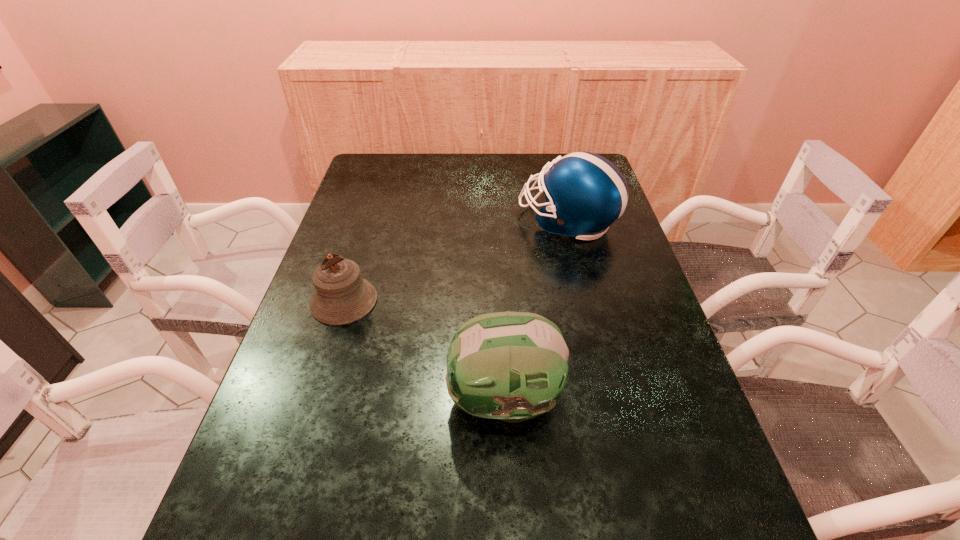
Locate an element on the screen. free space between the nearest object and the leftmost object is located at coordinates (423, 350).

Identify the location of free space between the nearest object and the bell. The width and height of the screenshot is (960, 540). (423, 350).

In order to click on unoccupied area between the farther football helmet and the leftmost object in this screenshot , I will do `click(456, 261)`.

Identify the location of blank region between the bell and the farther football helmet. The height and width of the screenshot is (540, 960). (456, 261).

This screenshot has height=540, width=960. In order to click on free space between the farther football helmet and the shortest object in this screenshot , I will do `click(456, 261)`.

Where is `free area in between the farther football helmet and the shortest object`? This screenshot has width=960, height=540. free area in between the farther football helmet and the shortest object is located at coordinates (456, 261).

I want to click on vacant region between the bell and the nearer football helmet, so click(423, 350).

Where is `object identified as the closest to the nearest object`? The width and height of the screenshot is (960, 540). object identified as the closest to the nearest object is located at coordinates (342, 296).

I want to click on object that stands as the closest to the nearer football helmet, so coord(342,296).

You are a GUI agent. You are given a task and a screenshot of the screen. Output one action in this format:
    pyautogui.click(x=<x>, y=<y>)
    Task: Click on the free region that satisfies the following two spatial constraints: 1. at the front of the farthest object with the faceguard; 2. on the front side of the shortest object
    
    Given the screenshot: What is the action you would take?
    pyautogui.click(x=587, y=301)